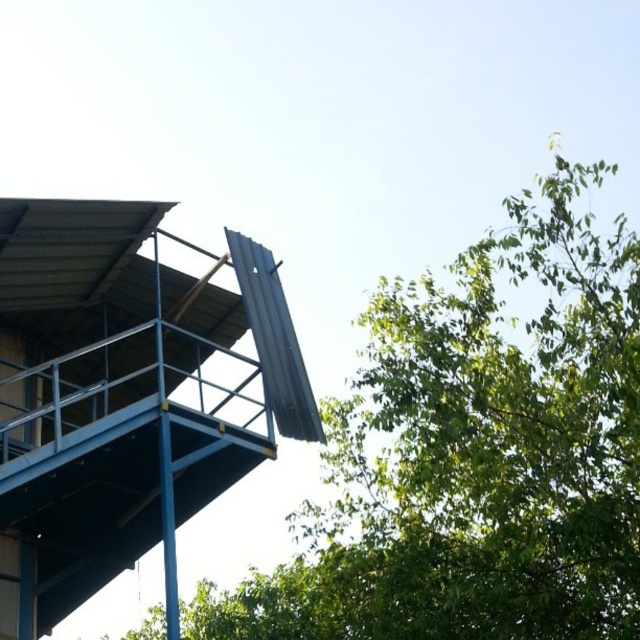
You are an architect evaluating the scene. You notice the green leafy tree at upper right and the metallic blue observation tower at upper left. Which object occupies more visual space in the image?

The green leafy tree at upper right occupies more visual space in the image as it is bigger than the metallic blue observation tower at upper left.